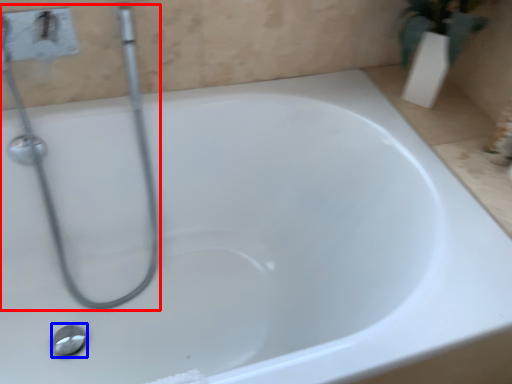
Question: Which object is closer to the camera taking this photo, plumbing fixture (highlighted by a red box) or shower (highlighted by a blue box)?

Choices:
 (A) plumbing fixture
 (B) shower

Answer: (A)